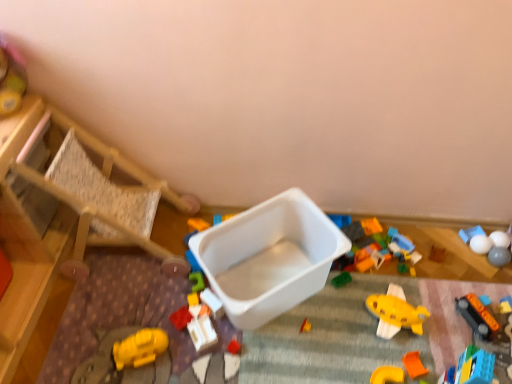
Question: Do you think blue plastic toy at center, the fourth toy from the left, is within yellow matte airplane at center, which appears as the 7th toy when viewed from the left, or outside of it?

Choices:
 (A) inside
 (B) outside

Answer: (B)

Question: From their relative heights in the image, would you say blue plastic toy at center, the 11th toy in the right-to-left sequence, is taller or shorter than yellow matte airplane at center, which appears as the 7th toy when viewed from the left?

Choices:
 (A) tall
 (B) short

Answer: (B)

Question: Which of these objects is positioned closest to the white glossy ball at upper right, the 11th toy in the left-to-right sequence?

Choices:
 (A) white matte balls at upper right, arranged as the 14th toy when viewed from the left
 (B) white plastic container at center, the third toy viewed from the left
 (C) wooden chair at left
 (D) blue plastic toy at center, the fourth toy from the left
 (E) rubberized plastic toy at center, the thirteenth toy positioned from the right

Answer: (A)

Question: Which is nearer to the brown matte toy at center, placed as the sixth toy when sorted from right to left?

Choices:
 (A) white plastic container at center
 (B) white matte balls at upper right, arranged as the 14th toy when viewed from the left
 (C) orange plastic train at lower right, the tenth toy in the left-to-right sequence
 (D) blue plastic toy at center, the 11th toy in the right-to-left sequence
 (E) smooth plastic container at upper left, which ranks as the 1th toy in left-to-right order

Answer: (B)